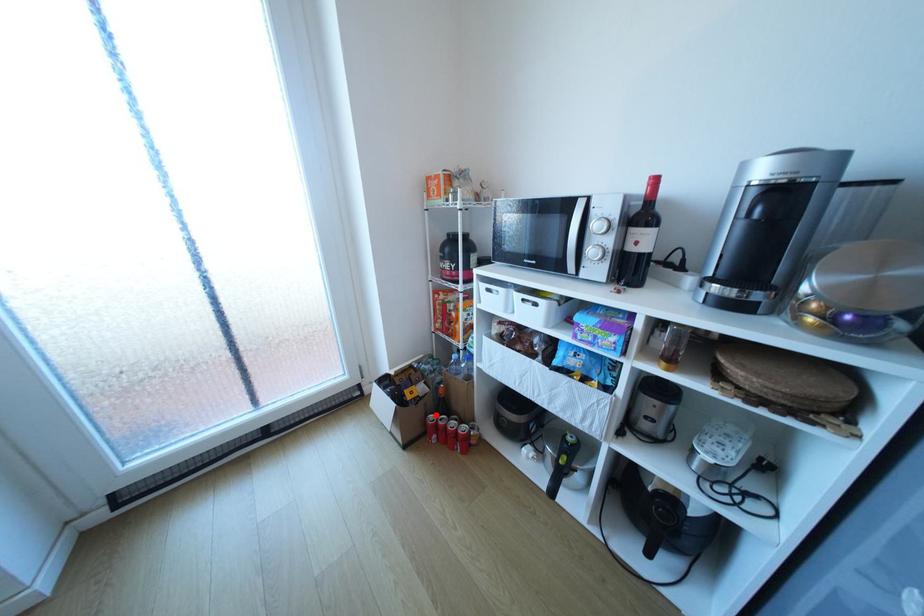
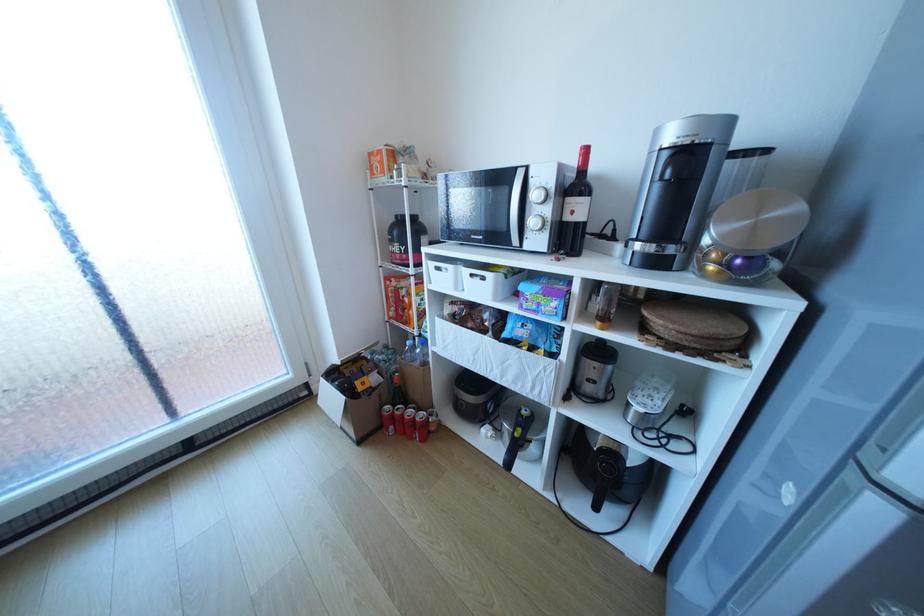
Question: I am providing you with two images of the same scene from different viewpoints. Given a red point in image1, look at the same physical point in image2. Is it:

Choices:
 (A) Closer to the viewpoint
 (B) Farther from the viewpoint

Answer: (A)